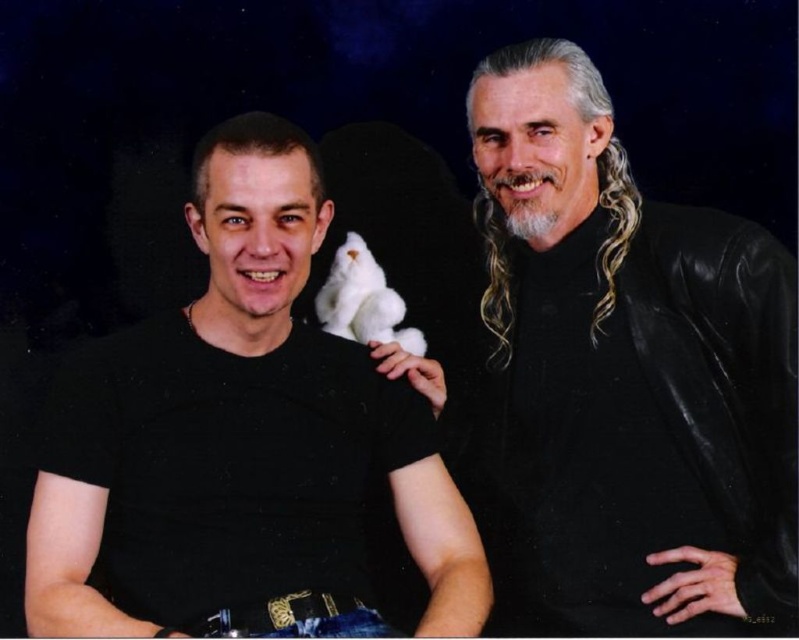
Between black matte t-shirt at left and white plush toy at center, which one has less height?

white plush toy at center is shorter.

Between point (144, 604) and point (368, 317), which one is positioned behind?

The point (368, 317) is behind.

The height and width of the screenshot is (640, 799). I want to click on black matte t-shirt at left, so click(x=301, y=392).

Consider the image. Is black leather jacket at right thinner than white plush toy at center?

No, black leather jacket at right is not thinner than white plush toy at center.

Who is more forward, (640, 483) or (348, 276)?

Point (640, 483)

Who is more distant from viewer, (519, 232) or (368, 300)?

The point (368, 300) is behind.

Locate an element on the screen. black leather jacket at right is located at coordinates click(629, 371).

Is black leather jacket at right below black matte t-shirt at left?

No, black leather jacket at right is not below black matte t-shirt at left.

Which is behind, point (656, 401) or point (86, 628)?

Positioned behind is point (656, 401).

Who is more forward, (591,88) or (284,513)?

Positioned in front is point (284,513).

You are a GUI agent. You are given a task and a screenshot of the screen. Output one action in this format:
    pyautogui.click(x=<x>, y=<y>)
    Task: Click on the black leather jacket at right
    The image size is (799, 640).
    Given the screenshot: What is the action you would take?
    pyautogui.click(x=629, y=371)